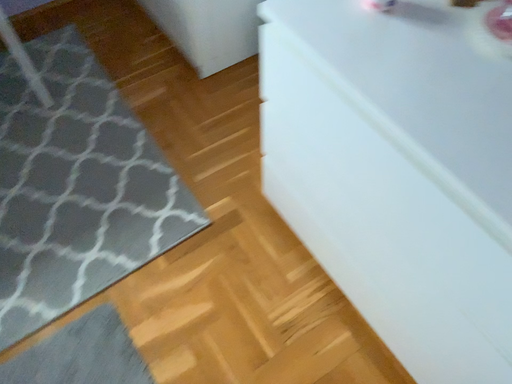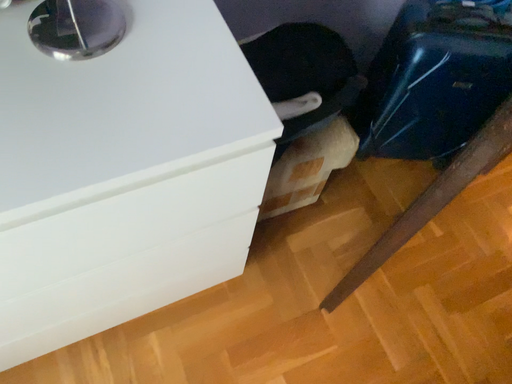
Question: How did the camera likely rotate when shooting the video?

Choices:
 (A) rotated right
 (B) rotated left

Answer: (A)